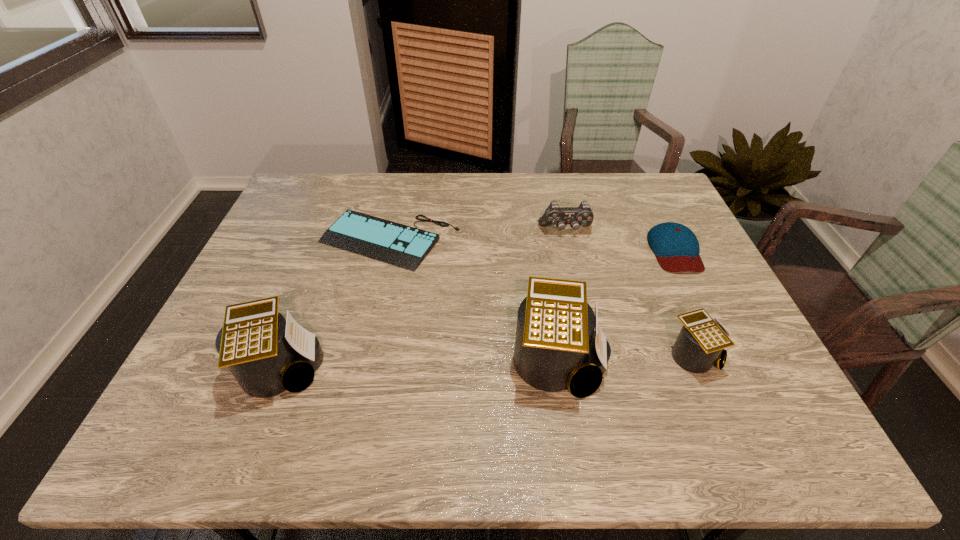
What are the coordinates of `the second shortest calculator` in the screenshot? It's located at [x=267, y=355].

The width and height of the screenshot is (960, 540). Identify the location of the fifth shortest object. (267, 355).

Where is `the second calculator from left to right`? The image size is (960, 540). the second calculator from left to right is located at coordinates (556, 347).

Where is `the rightmost calculator`? This screenshot has height=540, width=960. the rightmost calculator is located at coordinates (701, 341).

Find the location of a particular element. The image size is (960, 540). control is located at coordinates (583, 215).

The height and width of the screenshot is (540, 960). In order to click on baseball cap in this screenshot , I will do `click(676, 248)`.

Find the location of a particular element. This screenshot has height=540, width=960. the shortest object is located at coordinates (404, 246).

Locate an element on the screen. This screenshot has width=960, height=540. vacant space located 0.350m on the back of the fifth shortest object is located at coordinates (328, 244).

Locate an element on the screen. Image resolution: width=960 pixels, height=540 pixels. vacant space located 0.400m on the left of the second calculator from left to right is located at coordinates (339, 361).

Locate an element on the screen. The width and height of the screenshot is (960, 540). vacant region located on the right of the rightmost calculator is located at coordinates (757, 356).